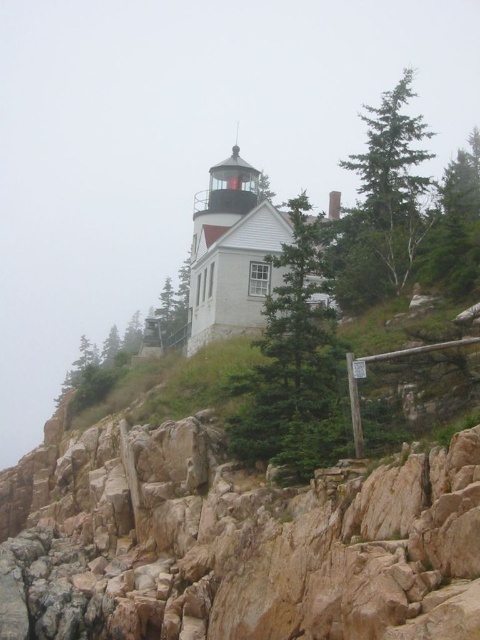
Is the position of green textured tree at center more distant than that of green matte tree at upper right?

No, it is in front of green matte tree at upper right.

Is green textured tree at center shorter than green matte tree at upper right?

Indeed, green textured tree at center has a lesser height compared to green matte tree at upper right.

Between point (276, 310) and point (469, 134), which one is positioned behind?

The point (469, 134) is behind.

Where is `green textured tree at center`? The width and height of the screenshot is (480, 640). green textured tree at center is located at coordinates (295, 364).

Does point (302, 342) come closer to viewer compared to point (427, 221)?

Yes, point (302, 342) is in front of point (427, 221).

This screenshot has height=640, width=480. I want to click on green textured tree at center, so click(x=295, y=364).

Does point (300, 352) come farther from viewer compared to point (358, 164)?

No.

You are a GUI agent. You are given a task and a screenshot of the screen. Output one action in this format:
    pyautogui.click(x=<x>, y=<y>)
    Task: Click on the green textured tree at center
    
    Given the screenshot: What is the action you would take?
    pyautogui.click(x=295, y=364)

Image resolution: width=480 pixels, height=640 pixels. What are the coordinates of `green textured tree at upper right` in the screenshot? It's located at (383, 204).

Who is positioned more to the left, green textured tree at upper right or green matte tree at upper right?

green textured tree at upper right is more to the left.

Which is in front, point (396, 273) or point (478, 141)?

Point (396, 273) is more forward.

Locate an element on the screen. green textured tree at upper right is located at coordinates (383, 204).